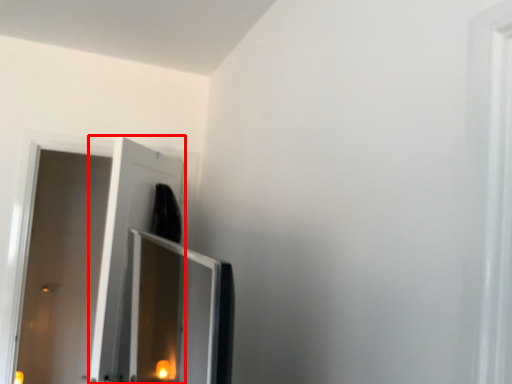
Question: From the image's perspective, what is the correct spatial positioning of screen door (annotated by the red box) in reference to door?

Choices:
 (A) above
 (B) below

Answer: (B)